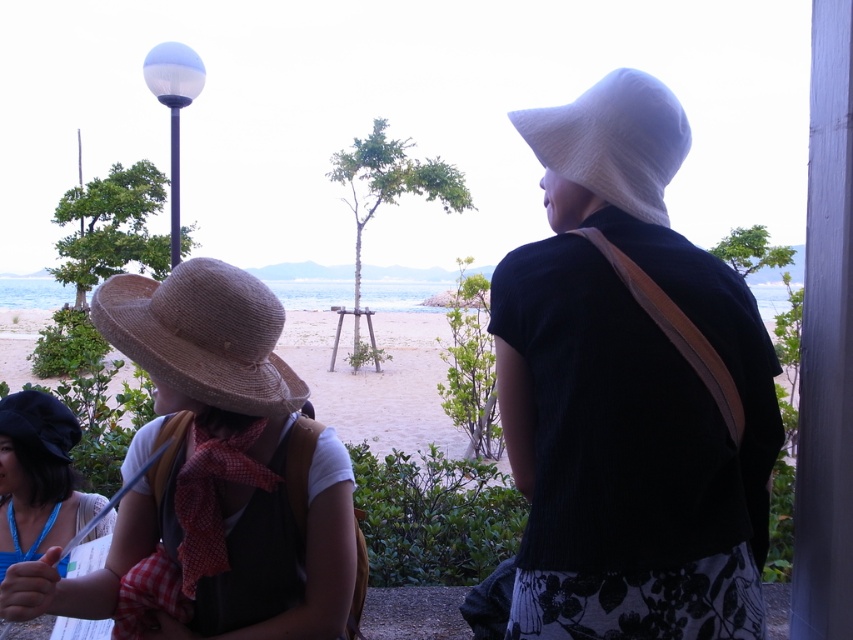
Based on the photo, who is more forward, (230, 536) or (99, 531)?

Point (230, 536) is more forward.

Image resolution: width=853 pixels, height=640 pixels. What do you see at coordinates (216, 472) in the screenshot?
I see `brown straw hat at center` at bounding box center [216, 472].

At what (x,y) coordinates should I click in order to perform the action: click on brown straw hat at center. Please return your answer as a coordinate pair (x, y). Looking at the image, I should click on (216, 472).

Is white straw hat at upper right wider than matte black hat at lower left?

In fact, white straw hat at upper right might be narrower than matte black hat at lower left.

Does point (646, 136) come closer to viewer compared to point (73, 428)?

Yes.

What do you see at coordinates (613, 140) in the screenshot? I see `white straw hat at upper right` at bounding box center [613, 140].

Find the location of a particular element. The width and height of the screenshot is (853, 640). white straw hat at upper right is located at coordinates (613, 140).

Between strawmaterial/texturehat at left and white straw hat at upper right, which one is positioned higher?

Positioned higher is white straw hat at upper right.

Does strawmaterial/texturehat at left have a larger size compared to white straw hat at upper right?

Indeed, strawmaterial/texturehat at left has a larger size compared to white straw hat at upper right.

The width and height of the screenshot is (853, 640). What do you see at coordinates (202, 336) in the screenshot?
I see `strawmaterial/texturehat at left` at bounding box center [202, 336].

You are a GUI agent. You are given a task and a screenshot of the screen. Output one action in this format:
    pyautogui.click(x=<x>, y=<y>)
    Task: Click on the strawmaterial/texturehat at left
    The height and width of the screenshot is (640, 853).
    Given the screenshot: What is the action you would take?
    pyautogui.click(x=202, y=336)